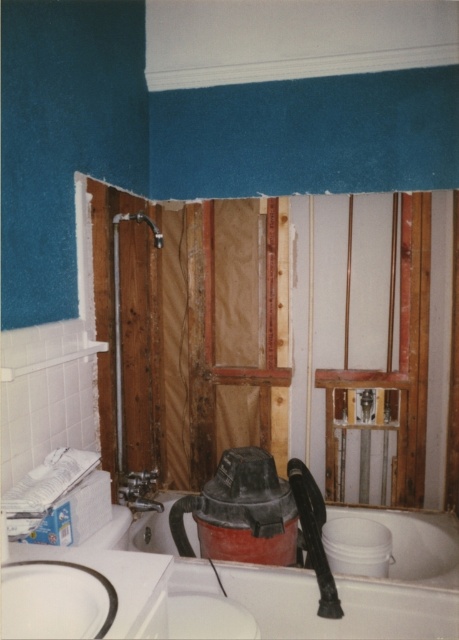
Which is behind, point (26, 593) or point (203, 260)?

The point (203, 260) is behind.

Is white glossy sink at lower left bigger than wooden panel at center?

No.

Who is more distant from viewer, (x=66, y=624) or (x=212, y=362)?

The point (x=212, y=362) is more distant.

The height and width of the screenshot is (640, 459). What are the coordinates of `white glossy sink at lower left` in the screenshot? It's located at (x=115, y=582).

Is white glossy bathtub at lower center smaller than wooden panel at center?

Actually, white glossy bathtub at lower center might be larger than wooden panel at center.

Is point (145, 518) positioned behind point (205, 228)?

No, it is in front of (205, 228).

Is point (393, 636) farther from camera compared to point (268, 326)?

No.

The image size is (459, 640). Find the location of `white glossy bathtub at lower center`. white glossy bathtub at lower center is located at coordinates (363, 586).

Who is higher up, white glossy bathtub at lower center or white glossy sink at lower left?

Positioned higher is white glossy sink at lower left.

Is point (100, 547) in front of point (169, 570)?

No, (100, 547) is further to viewer.

What do you see at coordinates (363, 586) in the screenshot? I see `white glossy bathtub at lower center` at bounding box center [363, 586].

Where is `white glossy bathtub at lower center`? white glossy bathtub at lower center is located at coordinates (363, 586).